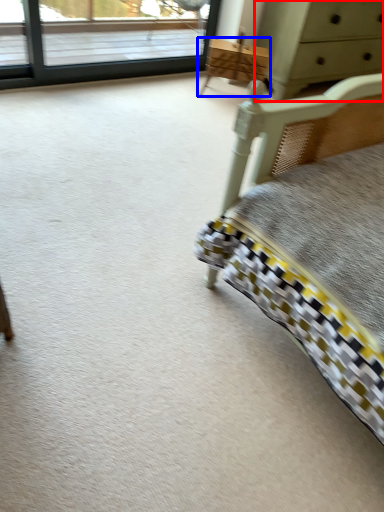
Question: Which of the following is the closest to the observer, chest of drawers (highlighted by a red box) or furniture (highlighted by a blue box)?

Choices:
 (A) chest of drawers
 (B) furniture

Answer: (A)